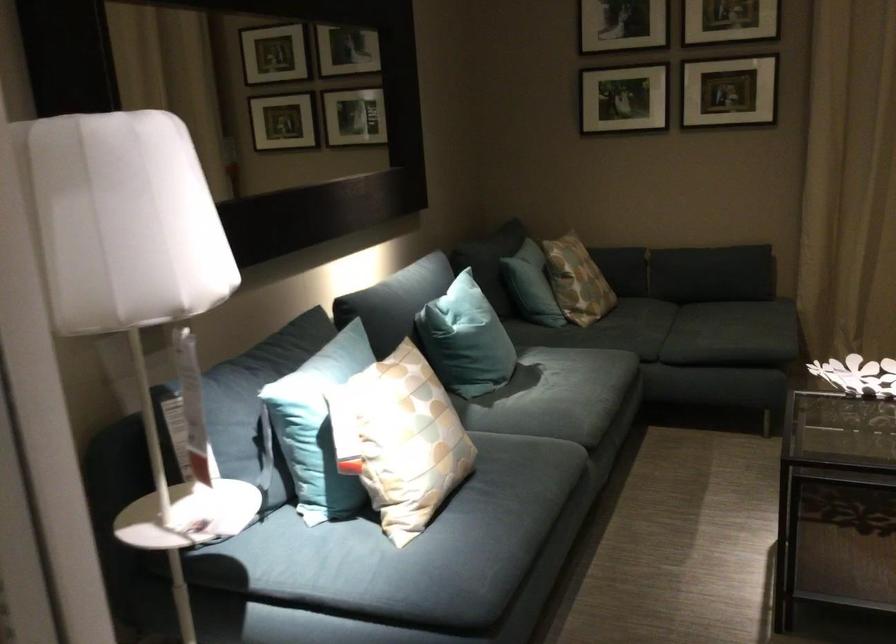
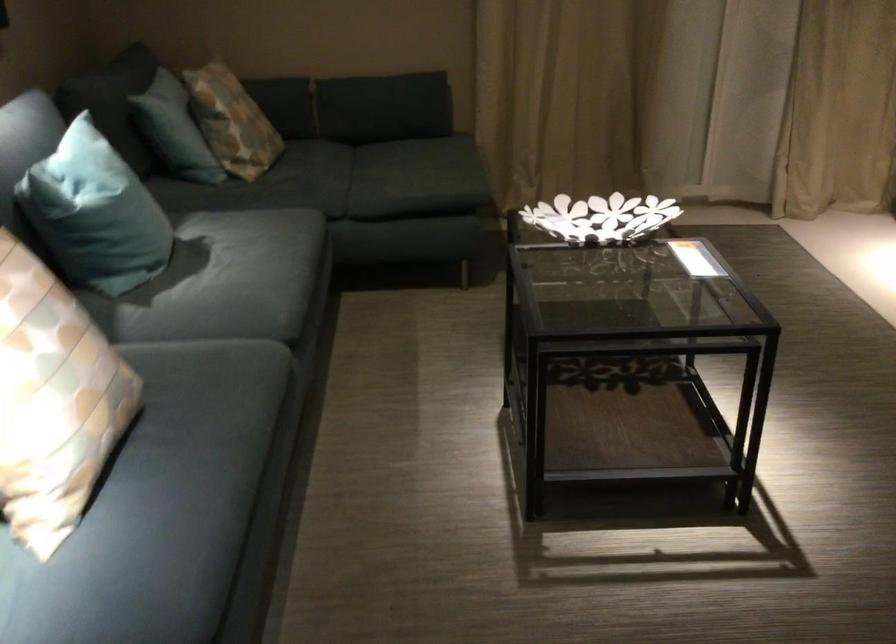
Question: The images are taken continuously from a first-person perspective. In which direction is your viewpoint rotating?

Choices:
 (A) Left
 (B) Right
 (C) Up
 (D) Down

Answer: (B)